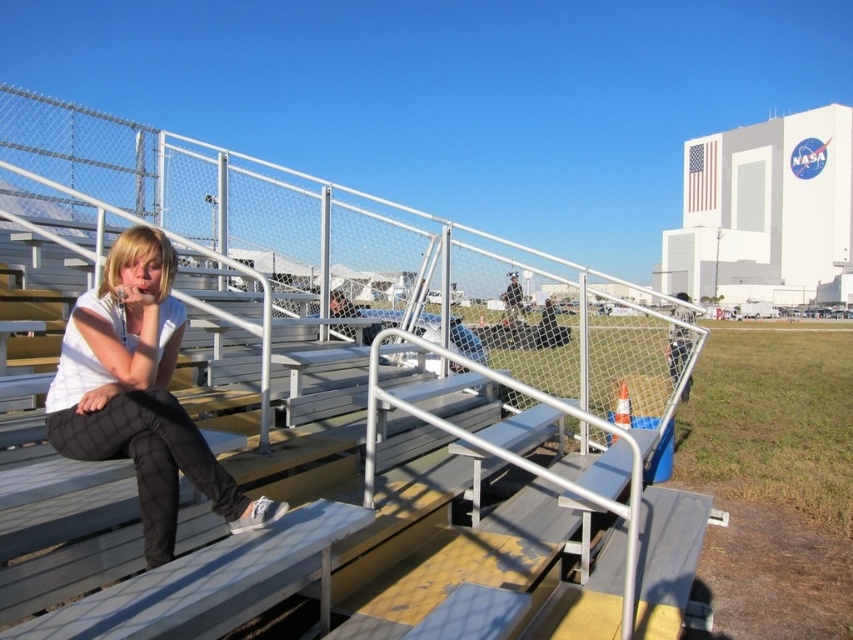
Where is `metallic silver rail at center`? Image resolution: width=853 pixels, height=640 pixels. metallic silver rail at center is located at coordinates (326, 262).

Who is positioned more to the left, metallic silver rail at center or white matte shirt at center?

white matte shirt at center

Does metallic silver rail at center have a larger size compared to white matte shirt at center?

Yes, metallic silver rail at center is bigger than white matte shirt at center.

Describe the element at coordinates (326, 262) in the screenshot. The image size is (853, 640). I see `metallic silver rail at center` at that location.

This screenshot has height=640, width=853. I want to click on metallic silver rail at center, so click(x=326, y=262).

Between white matte shirt at center and metallic gray bleachers at left, which one has more height?

Standing taller between the two is white matte shirt at center.

Can you confirm if white matte shirt at center is positioned to the right of metallic gray bleachers at left?

Incorrect, white matte shirt at center is not on the right side of metallic gray bleachers at left.

Looking at this image, measure the distance between white matte shirt at center and camera.

white matte shirt at center is 6.22 feet away from camera.

The width and height of the screenshot is (853, 640). I want to click on white matte shirt at center, so click(138, 394).